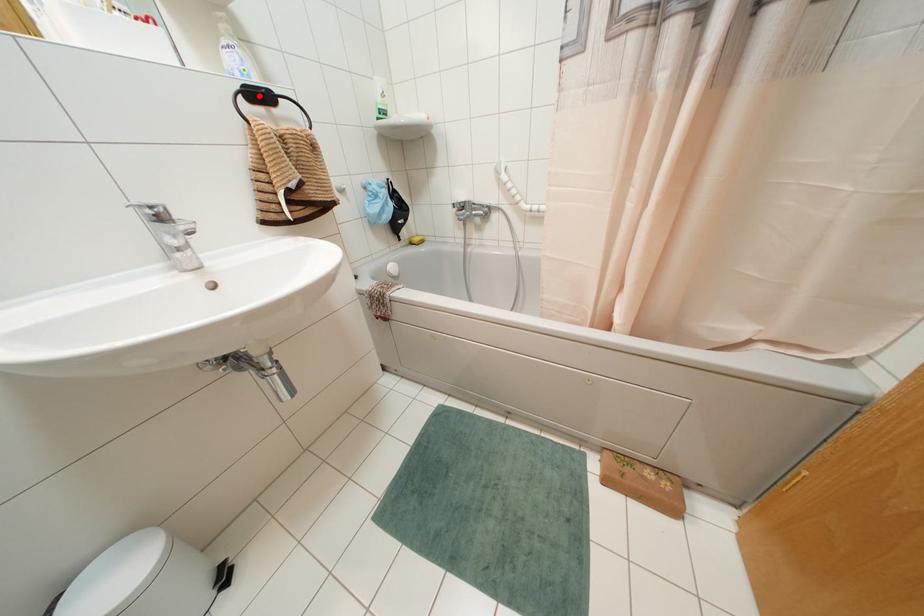
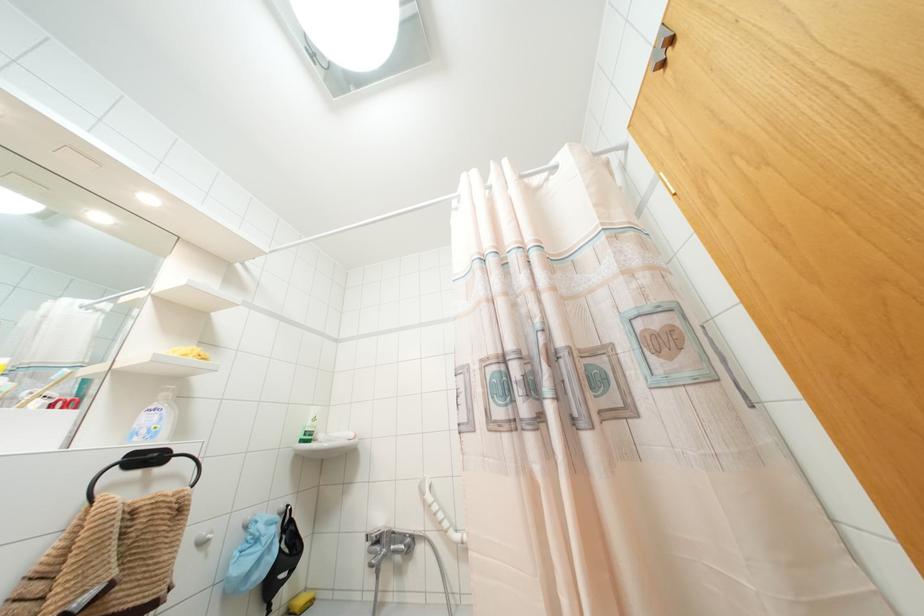
Find the pixel in the second image that matches the highlighted location in the first image.

(147, 458)